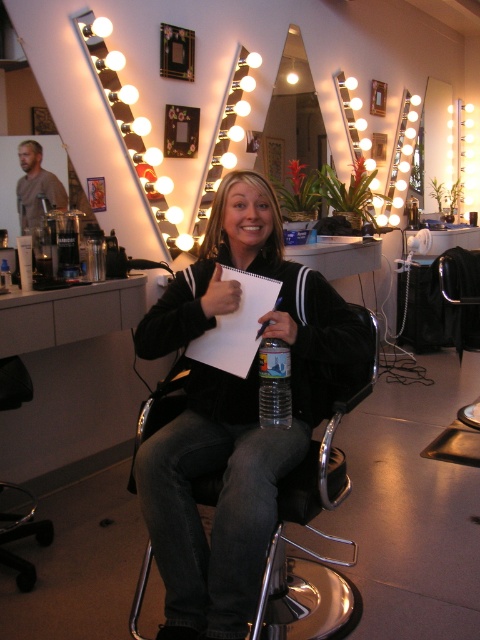
Does metallic silver swivel chair at lower left have a greater width compared to matte brown hair at upper left?

Yes, metallic silver swivel chair at lower left is wider than matte brown hair at upper left.

Is the position of metallic silver swivel chair at lower left less distant than that of matte brown hair at upper left?

Yes, metallic silver swivel chair at lower left is in front of matte brown hair at upper left.

Is point (3, 486) farther from camera compared to point (27, 205)?

No, (3, 486) is in front of (27, 205).

Locate an element on the screen. This screenshot has height=640, width=480. metallic silver swivel chair at lower left is located at coordinates (22, 538).

Between black velvet jacket at center and metallic silver swivel chair at lower left, which one has less height?

metallic silver swivel chair at lower left is shorter.

Which is more to the right, black velvet jacket at center or metallic silver swivel chair at lower left?

From the viewer's perspective, black velvet jacket at center appears more on the right side.

Is point (263, 273) more distant than point (1, 484)?

No, (263, 273) is closer to viewer.

Find the location of a particular element. The width and height of the screenshot is (480, 640). black velvet jacket at center is located at coordinates (236, 413).

Does point (237, 262) come behind point (34, 225)?

No, it is not.

Who is positioned more to the right, black velvet jacket at center or matte brown hair at upper left?

black velvet jacket at center is more to the right.

Is point (247, 257) farther from camera compared to point (45, 195)?

No, (247, 257) is closer to viewer.

Identify the location of black velvet jacket at center. (236, 413).